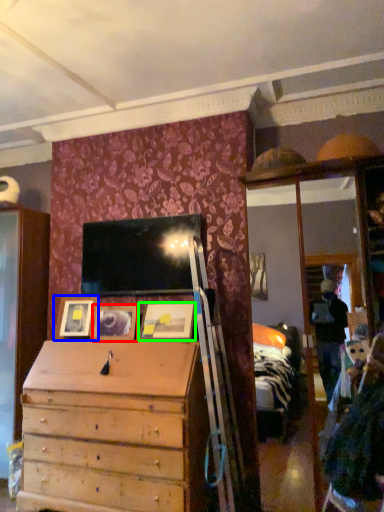
Question: Which is farther away from picture frame (highlighted by a red box)? picture frame (highlighted by a blue box) or picture frame (highlighted by a green box)?

Choices:
 (A) picture frame
 (B) picture frame

Answer: (B)